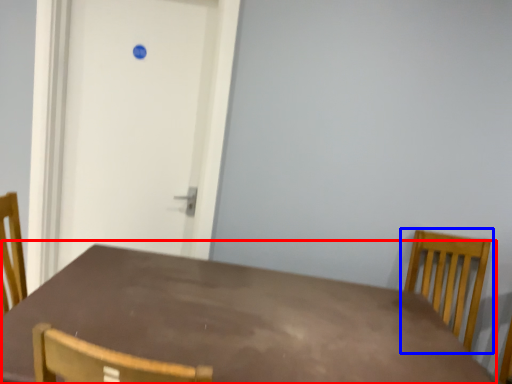
Question: Which point is closer to the camera, table (highlighted by a red box) or chair (highlighted by a blue box)?

Choices:
 (A) table
 (B) chair

Answer: (A)